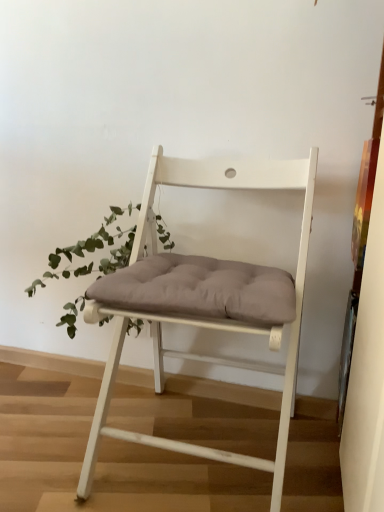
Question: Can you confirm if green leafy plant at left is smaller than white wood chair at center?

Choices:
 (A) yes
 (B) no

Answer: (A)

Question: Does green leafy plant at left appear on the right side of white wood chair at center?

Choices:
 (A) yes
 (B) no

Answer: (B)

Question: Does green leafy plant at left lie behind white wood chair at center?

Choices:
 (A) no
 (B) yes

Answer: (B)

Question: Considering the relative positions of green leafy plant at left and white wood chair at center in the image provided, is green leafy plant at left in front of white wood chair at center?

Choices:
 (A) yes
 (B) no

Answer: (B)

Question: Is white wood chair at center surrounded by green leafy plant at left?

Choices:
 (A) yes
 (B) no

Answer: (B)

Question: From a real-world perspective, does green leafy plant at left stand above white wood chair at center?

Choices:
 (A) no
 (B) yes

Answer: (A)

Question: Can you confirm if white wood chair at center is wider than green leafy plant at left?

Choices:
 (A) yes
 (B) no

Answer: (A)

Question: Would you say white wood chair at center is a long distance from green leafy plant at left?

Choices:
 (A) no
 (B) yes

Answer: (A)

Question: Is white wood chair at center oriented towards green leafy plant at left?

Choices:
 (A) no
 (B) yes

Answer: (A)

Question: From the image's perspective, would you say white wood chair at center is shown under green leafy plant at left?

Choices:
 (A) yes
 (B) no

Answer: (A)

Question: From a real-world perspective, is white wood chair at center physically above green leafy plant at left?

Choices:
 (A) no
 (B) yes

Answer: (B)

Question: Is white wood chair at center in contact with green leafy plant at left?

Choices:
 (A) yes
 (B) no

Answer: (B)

Question: From the image's perspective, is green leafy plant at left located above or below white wood chair at center?

Choices:
 (A) above
 (B) below

Answer: (A)